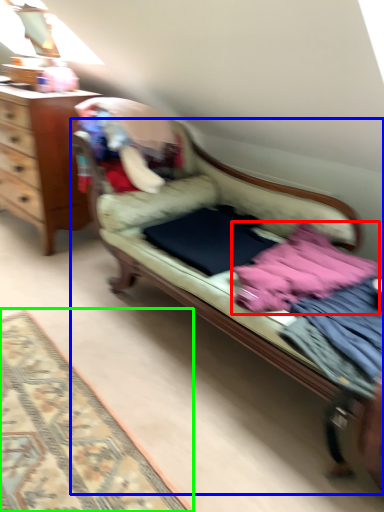
Question: Estimate the real-world distances between objects in this image. Which object is farther from baby clothe (highlighted by a red box), studio couch (highlighted by a blue box) or mat (highlighted by a green box)?

Choices:
 (A) studio couch
 (B) mat

Answer: (B)